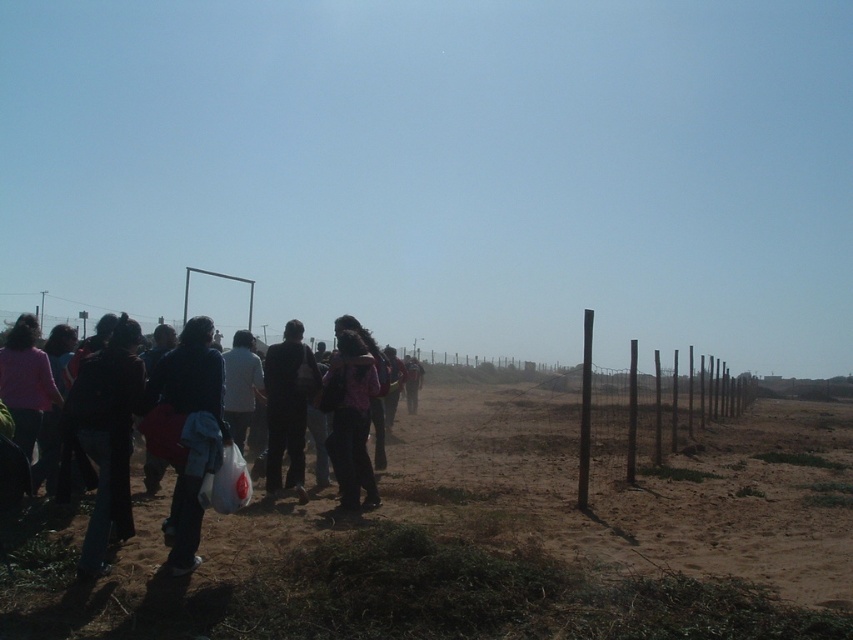
Who is positioned more to the left, dark clothing group at left or dark blue suit at center?

dark clothing group at left

Who is more forward, (212, 353) or (285, 369)?

Positioned in front is point (212, 353).

I want to click on dark clothing group at left, so click(x=152, y=438).

Is brown sandy dirt field at lower center thinner than dark blue suit at center?

Incorrect, brown sandy dirt field at lower center's width is not less than dark blue suit at center's.

Does brown sandy dirt field at lower center have a greater height compared to dark blue suit at center?

Indeed, brown sandy dirt field at lower center has a greater height compared to dark blue suit at center.

Identify the location of brown sandy dirt field at lower center. Image resolution: width=853 pixels, height=640 pixels. (492, 540).

You are a GUI agent. You are given a task and a screenshot of the screen. Output one action in this format:
    pyautogui.click(x=<x>, y=<y>)
    Task: Click on the brown sandy dirt field at lower center
    Image resolution: width=853 pixels, height=640 pixels.
    Given the screenshot: What is the action you would take?
    pyautogui.click(x=492, y=540)

Does point (129, 358) come closer to viewer compared to point (183, 499)?

Yes, it is in front of point (183, 499).

Is dark clothing group at left positioned before dark blue fabric jacket at left?

Yes, it is in front of dark blue fabric jacket at left.

This screenshot has width=853, height=640. In order to click on dark clothing group at left in this screenshot , I will do `click(152, 438)`.